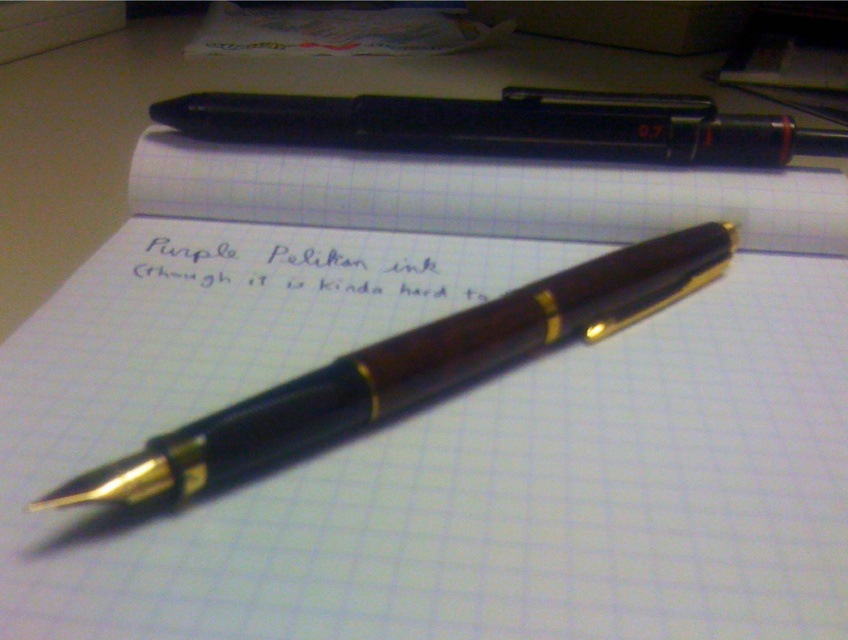
Is matte black pen at upper center above purple pelikan ink at center?

Yes, matte black pen at upper center is above purple pelikan ink at center.

Is matte black pen at upper center shorter than purple pelikan ink at center?

No, matte black pen at upper center is not shorter than purple pelikan ink at center.

Is point (782, 154) positioned after point (411, 237)?

No.

You are a GUI agent. You are given a task and a screenshot of the screen. Output one action in this format:
    pyautogui.click(x=<x>, y=<y>)
    Task: Click on the matte black pen at upper center
    The image size is (848, 640).
    Given the screenshot: What is the action you would take?
    pyautogui.click(x=505, y=125)

Consider the image. How far apart are wooden pen at center and matte black pen at upper center?

A distance of 11.42 inches exists between wooden pen at center and matte black pen at upper center.

Between wooden pen at center and matte black pen at upper center, which one has more height?

wooden pen at center

Where is `wooden pen at center`? wooden pen at center is located at coordinates (409, 369).

Does point (272, 397) come behind point (154, 248)?

That is False.

Measure the distance between wooden pen at center and camera.

wooden pen at center and camera are 22.71 inches apart from each other.

Between point (674, 272) and point (462, 285), which one is positioned behind?

Positioned behind is point (462, 285).

The image size is (848, 640). I want to click on wooden pen at center, so point(409,369).